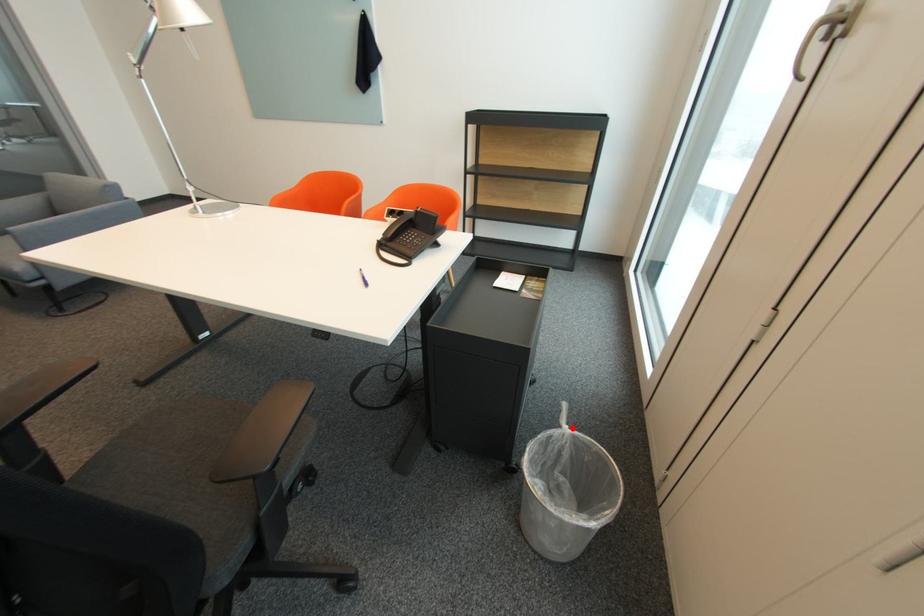
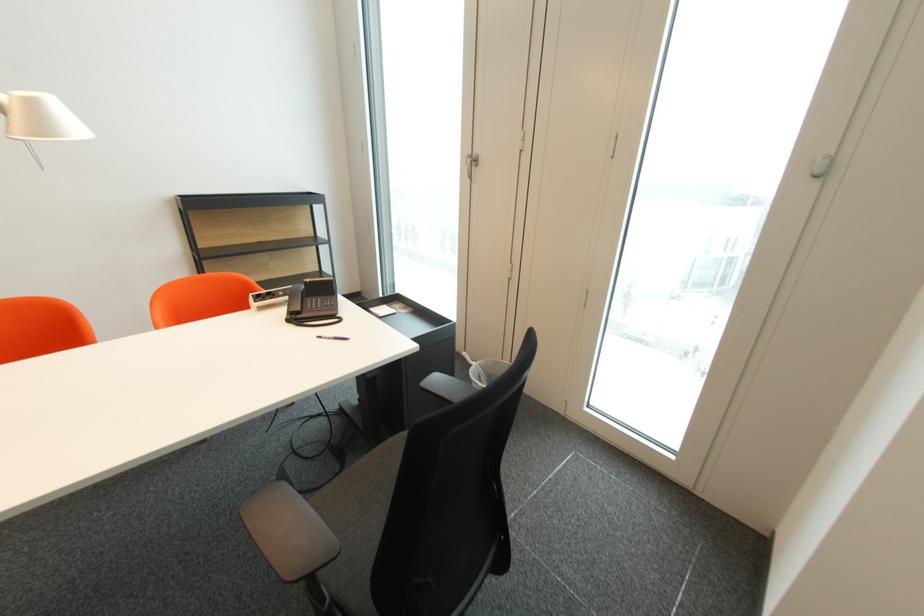
Question: I am providing you with two images of the same scene from different viewpoints. Image1 has a red point marked. In image2, the corresponding 3D location appears at what relative position? Reply with the corresponding letter.

Choices:
 (A) Closer
 (B) Farther

Answer: (B)